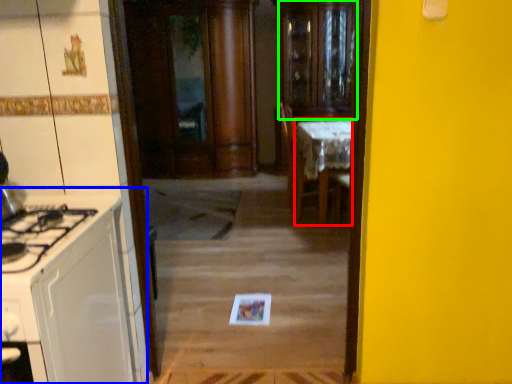
Question: Which object is positioned closest to table (highlighted by a red box)? Select from cabinetry (highlighted by a blue box) and glass door (highlighted by a green box).

Choices:
 (A) cabinetry
 (B) glass door

Answer: (B)